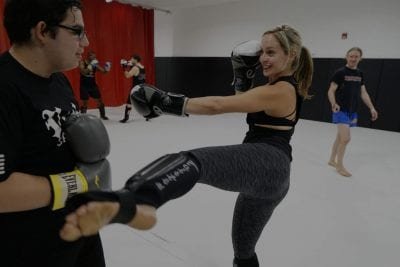
The image size is (400, 267). Identify the location of red curtain. [128, 35].